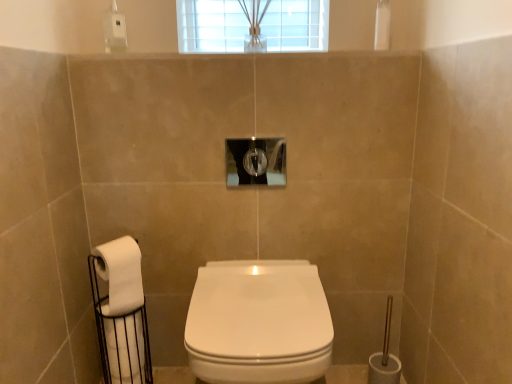
Question: Can you confirm if white matte toilet paper at lower left, acting as the first toilet paper starting from the top, is shorter than white glossy toilet at center?

Choices:
 (A) yes
 (B) no

Answer: (A)

Question: Considering the relative sizes of white matte toilet paper at lower left, acting as the first toilet paper starting from the top, and white glossy toilet at center in the image provided, is white matte toilet paper at lower left, acting as the first toilet paper starting from the top, thinner than white glossy toilet at center?

Choices:
 (A) yes
 (B) no

Answer: (A)

Question: Is white matte toilet paper at lower left, placed as the 2th toilet paper when sorted from bottom to top, wider than white glossy toilet at center?

Choices:
 (A) yes
 (B) no

Answer: (B)

Question: Is there a large distance between white matte toilet paper at lower left, placed as the 2th toilet paper when sorted from bottom to top, and white glossy toilet at center?

Choices:
 (A) yes
 (B) no

Answer: (B)

Question: From a real-world perspective, does white matte toilet paper at lower left, placed as the 2th toilet paper when sorted from bottom to top, sit lower than white glossy toilet at center?

Choices:
 (A) no
 (B) yes

Answer: (A)

Question: From the image's perspective, is white matte toilet paper at lower left, placed as the 2th toilet paper when sorted from bottom to top, on top of white glossy toilet at center?

Choices:
 (A) yes
 (B) no

Answer: (A)

Question: From a real-world perspective, is white glossy toilet at center on top of white matte toilet paper at left, the 1th toilet paper when ordered from bottom to top?

Choices:
 (A) no
 (B) yes

Answer: (B)

Question: From the image's perspective, is white glossy toilet at center beneath white matte toilet paper at left, the 1th toilet paper when ordered from bottom to top?

Choices:
 (A) yes
 (B) no

Answer: (B)

Question: Is white glossy toilet at center directly adjacent to white matte toilet paper at left, the 2th toilet paper in the top-to-bottom sequence?

Choices:
 (A) no
 (B) yes

Answer: (A)

Question: Does white glossy toilet at center appear on the right side of white matte toilet paper at left, the 2th toilet paper in the top-to-bottom sequence?

Choices:
 (A) no
 (B) yes

Answer: (B)

Question: Is white glossy toilet at center far away from white matte toilet paper at left, the 2th toilet paper in the top-to-bottom sequence?

Choices:
 (A) yes
 (B) no

Answer: (B)

Question: Can you confirm if white glossy toilet at center is wider than white matte toilet paper at left, the 2th toilet paper in the top-to-bottom sequence?

Choices:
 (A) no
 (B) yes

Answer: (B)

Question: From the image's perspective, is clear glass hole at center beneath white glossy toilet at center?

Choices:
 (A) yes
 (B) no

Answer: (B)